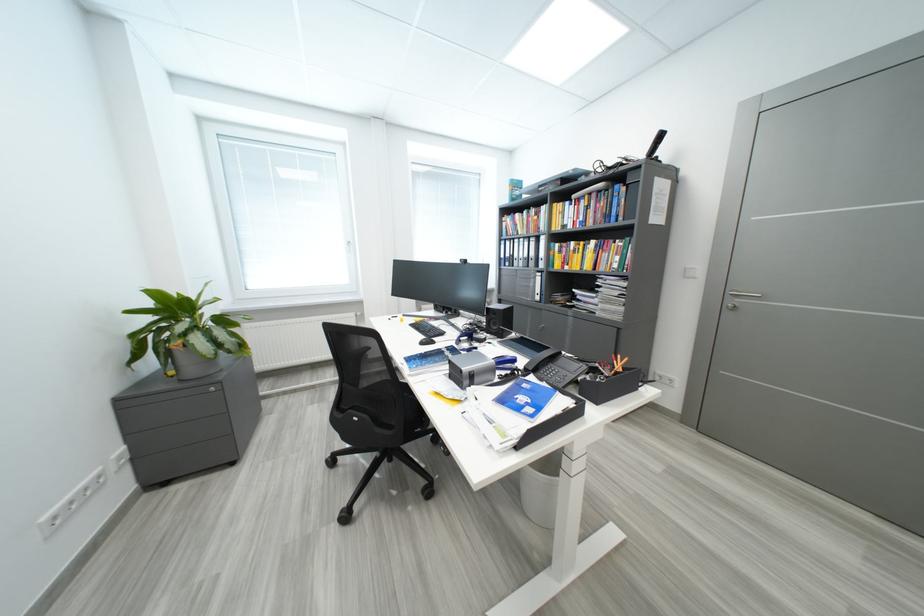
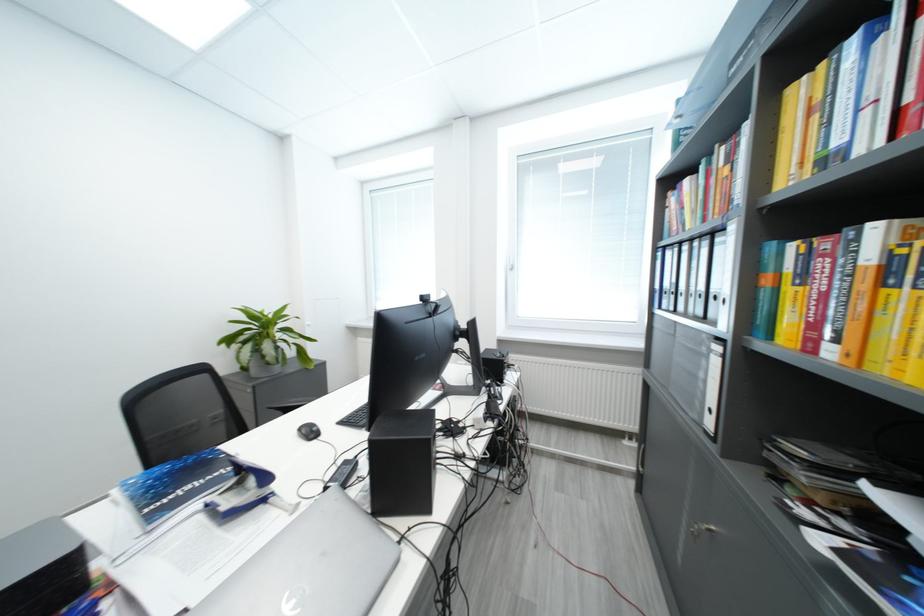
Where in the second image is the point corresponding to pixel 526 217 from the first image?

(696, 184)